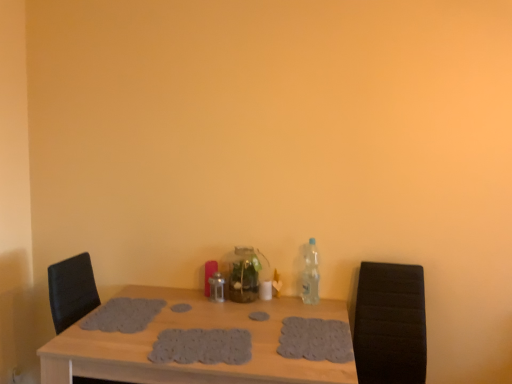
Question: Can you confirm if black leather armchair at right is thinner than gray knitted placemat at center, positioned as the 2th footprint in left-to-right order?

Choices:
 (A) yes
 (B) no

Answer: (B)

Question: Is black leather armchair at right at the right side of gray knitted placemat at center, the third footprint viewed from the right?

Choices:
 (A) yes
 (B) no

Answer: (A)

Question: Is black leather armchair at right facing away from gray knitted placemat at center, the third footprint viewed from the right?

Choices:
 (A) yes
 (B) no

Answer: (B)

Question: From a real-world perspective, does black leather armchair at right sit lower than gray knitted placemat at center, the third footprint viewed from the right?

Choices:
 (A) yes
 (B) no

Answer: (A)

Question: Is black leather armchair at right not near gray knitted placemat at center, the third footprint viewed from the right?

Choices:
 (A) yes
 (B) no

Answer: (B)

Question: From the image's perspective, is clear glass vase at center, the 1th bottle when ordered from left to right, above or below gray knitted placemat at center, positioned as the 2th footprint in left-to-right order?

Choices:
 (A) below
 (B) above

Answer: (B)

Question: Is clear glass vase at center, the 1th bottle when ordered from left to right, inside or outside of gray knitted placemat at center, positioned as the 2th footprint in left-to-right order?

Choices:
 (A) outside
 (B) inside

Answer: (A)

Question: Looking at their shapes, would you say clear glass vase at center, which is the second bottle from right to left, is wider or thinner than gray knitted placemat at center, the third footprint viewed from the right?

Choices:
 (A) wide
 (B) thin

Answer: (B)

Question: From their relative heights in the image, would you say clear glass vase at center, the 1th bottle when ordered from left to right, is taller or shorter than gray knitted placemat at center, positioned as the 2th footprint in left-to-right order?

Choices:
 (A) short
 (B) tall

Answer: (B)

Question: In terms of size, does wooden table at center appear bigger or smaller than black leather armchair at right?

Choices:
 (A) small
 (B) big

Answer: (B)

Question: In the image, is wooden table at center positioned in front of or behind black leather armchair at right?

Choices:
 (A) front
 (B) behind

Answer: (A)

Question: In the image, is wooden table at center on the left side or the right side of black leather armchair at right?

Choices:
 (A) right
 (B) left

Answer: (B)

Question: From a real-world perspective, relative to black leather armchair at right, is wooden table at center vertically above or below?

Choices:
 (A) above
 (B) below

Answer: (B)

Question: Looking at their shapes, would you say clear glass vase at center, which is the second bottle from right to left, is wider or thinner than gray crocheted placemat at center, the first footprint in the left-to-right sequence?

Choices:
 (A) thin
 (B) wide

Answer: (A)

Question: Does point (248, 291) appear closer or farther from the camera than point (115, 312)?

Choices:
 (A) farther
 (B) closer

Answer: (A)